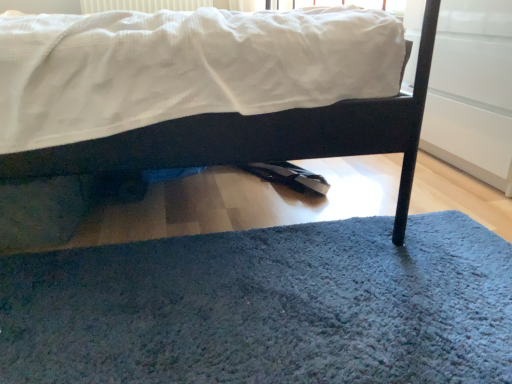
Question: From a real-world perspective, does blue shaggy rug at lower center stand above matte black bed at center?

Choices:
 (A) no
 (B) yes

Answer: (A)

Question: Is blue shaggy rug at lower center in front of matte black bed at center?

Choices:
 (A) no
 (B) yes

Answer: (B)

Question: Considering the relative sizes of blue shaggy rug at lower center and matte black bed at center in the image provided, is blue shaggy rug at lower center shorter than matte black bed at center?

Choices:
 (A) yes
 (B) no

Answer: (A)

Question: Considering the relative positions of blue shaggy rug at lower center and matte black bed at center in the image provided, is blue shaggy rug at lower center to the right of matte black bed at center from the viewer's perspective?

Choices:
 (A) yes
 (B) no

Answer: (A)

Question: Is blue shaggy rug at lower center positioned behind matte black bed at center?

Choices:
 (A) no
 (B) yes

Answer: (A)

Question: Can you confirm if blue shaggy rug at lower center is taller than matte black bed at center?

Choices:
 (A) yes
 (B) no

Answer: (B)

Question: Considering the relative sizes of matte black bed at center and blue shaggy rug at lower center in the image provided, is matte black bed at center thinner than blue shaggy rug at lower center?

Choices:
 (A) yes
 (B) no

Answer: (B)

Question: From the image's perspective, is matte black bed at center on blue shaggy rug at lower center?

Choices:
 (A) yes
 (B) no

Answer: (A)

Question: Considering the relative sizes of matte black bed at center and blue shaggy rug at lower center in the image provided, is matte black bed at center shorter than blue shaggy rug at lower center?

Choices:
 (A) no
 (B) yes

Answer: (A)

Question: Is matte black bed at center positioned in front of blue shaggy rug at lower center?

Choices:
 (A) no
 (B) yes

Answer: (A)

Question: Is matte black bed at center positioned far away from blue shaggy rug at lower center?

Choices:
 (A) no
 (B) yes

Answer: (A)

Question: Does matte black bed at center touch blue shaggy rug at lower center?

Choices:
 (A) no
 (B) yes

Answer: (A)

Question: From a real-world perspective, is blue shaggy rug at lower center positioned above or below matte black bed at center?

Choices:
 (A) above
 (B) below

Answer: (B)